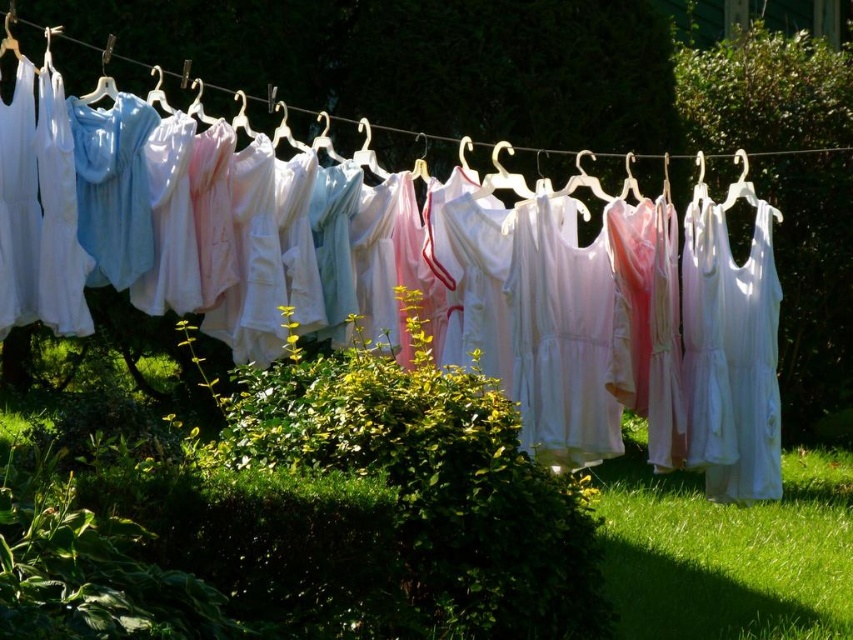
You are a gardener who wants to water the green grass at lower right without getting the white fabric at center wet. Can you water the grass directly below the fabric?

The white fabric at center is positioned over green grass at lower right, so watering the grass directly below the fabric would get the fabric wet. You should water around the area instead.

You are standing in the garden looking at the clothesline. There are two points marked on the clothesline, one at coordinates point (x=584, y=385) and the other at point (x=183, y=102). Which point is nearer to you?

Point (x=584, y=385) is closer to the viewer than point (x=183, y=102).